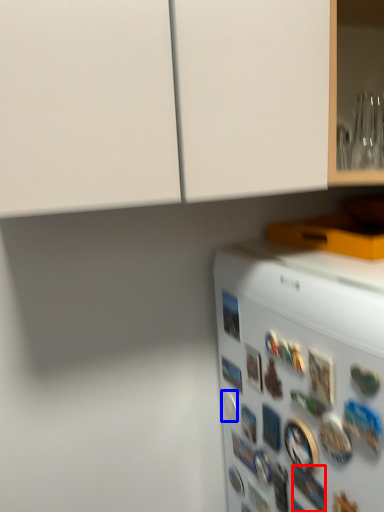
Question: Which of the following is the farthest to the observer, button (highlighted by a red box) or button (highlighted by a blue box)?

Choices:
 (A) button
 (B) button

Answer: (B)